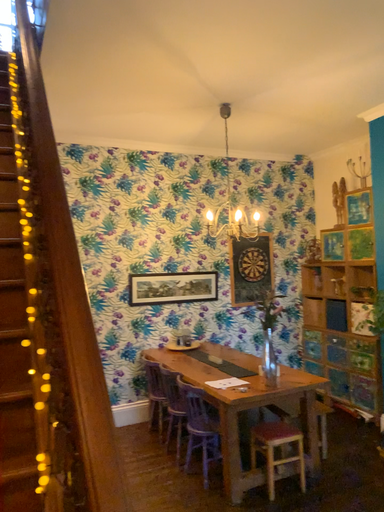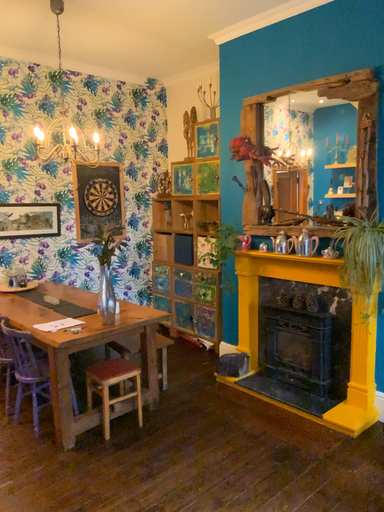
Question: How did the camera likely rotate when shooting the video?

Choices:
 (A) rotated left
 (B) rotated right

Answer: (B)